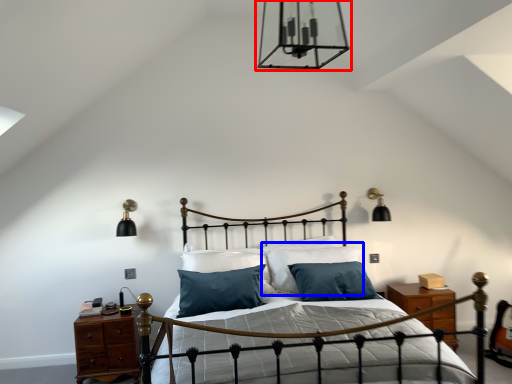
Question: Which of the following is the farthest to the observer, light fixture (highlighted by a red box) or pillow (highlighted by a blue box)?

Choices:
 (A) light fixture
 (B) pillow

Answer: (B)